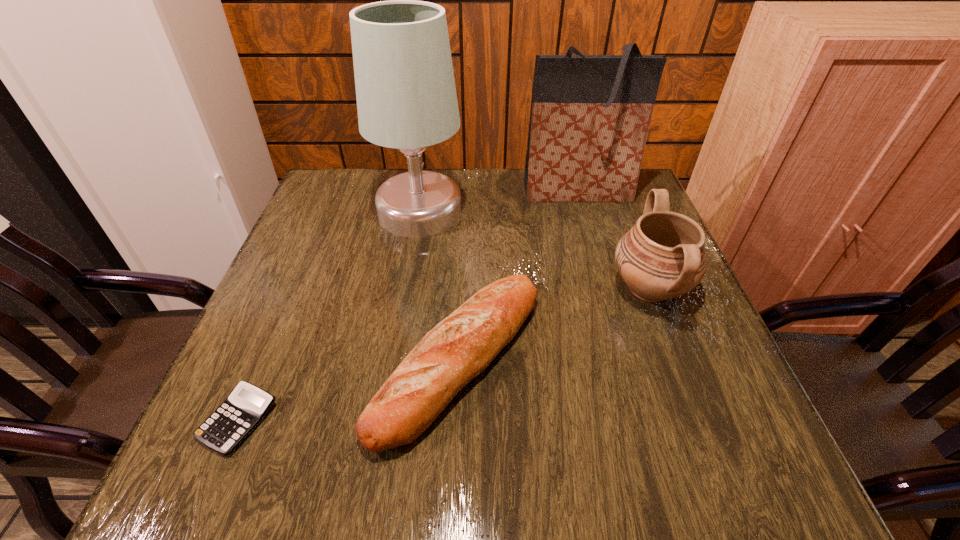
Locate an element on the screen. The image size is (960, 540). object situated at the near left corner is located at coordinates (245, 407).

The height and width of the screenshot is (540, 960). I want to click on object present at the far right corner, so click(590, 115).

I want to click on vacant region at the far edge of the desktop, so click(x=490, y=173).

Find the location of `blank space at the near edge of the desktop`. blank space at the near edge of the desktop is located at coordinates (578, 444).

At what (x,y) coordinates should I click in order to perform the action: click on free space at the left edge of the desktop. Please return your answer as a coordinate pair (x, y). This screenshot has width=960, height=540. Looking at the image, I should click on (328, 253).

Identify the location of vacant area at the right edge of the desktop. (689, 303).

Locate an element on the screen. This screenshot has width=960, height=540. blank space at the near left corner is located at coordinates (287, 472).

Identify the location of vacant space at the far right corner of the desktop. The height and width of the screenshot is (540, 960). (603, 205).

Find the location of a particular element. Image resolution: width=960 pixels, height=540 pixels. free point between the lampshade and the second tallest object is located at coordinates (498, 202).

The image size is (960, 540). I want to click on vacant space that is in between the second shortest object and the calculator, so click(348, 389).